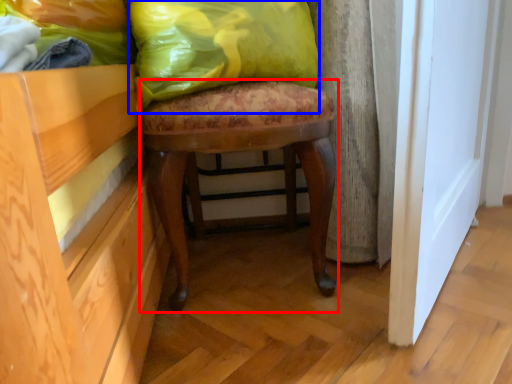
Question: Which object is closer to the camera taking this photo, stool (highlighted by a red box) or throw pillow (highlighted by a blue box)?

Choices:
 (A) stool
 (B) throw pillow

Answer: (B)